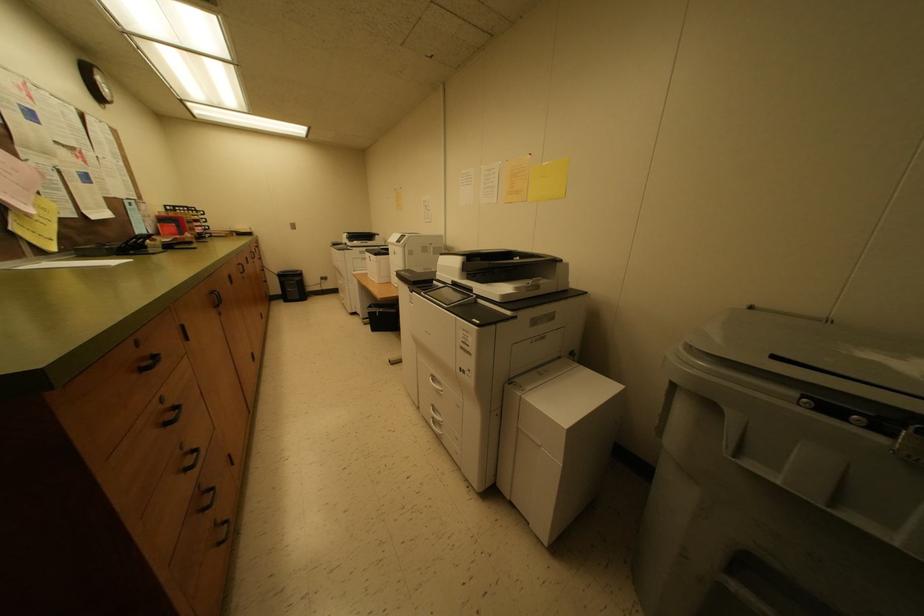
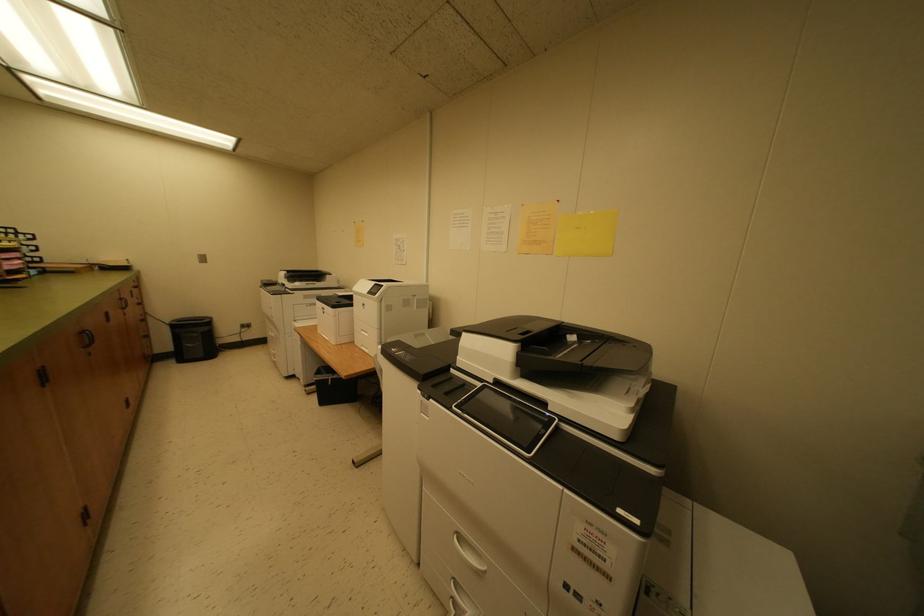
Question: The camera is either moving clockwise (left) or counter-clockwise (right) around the object. The first image is from the beginning of the video and the second image is from the end. Is the camera moving left or right when shooting the video?

Choices:
 (A) Left
 (B) Right

Answer: (A)